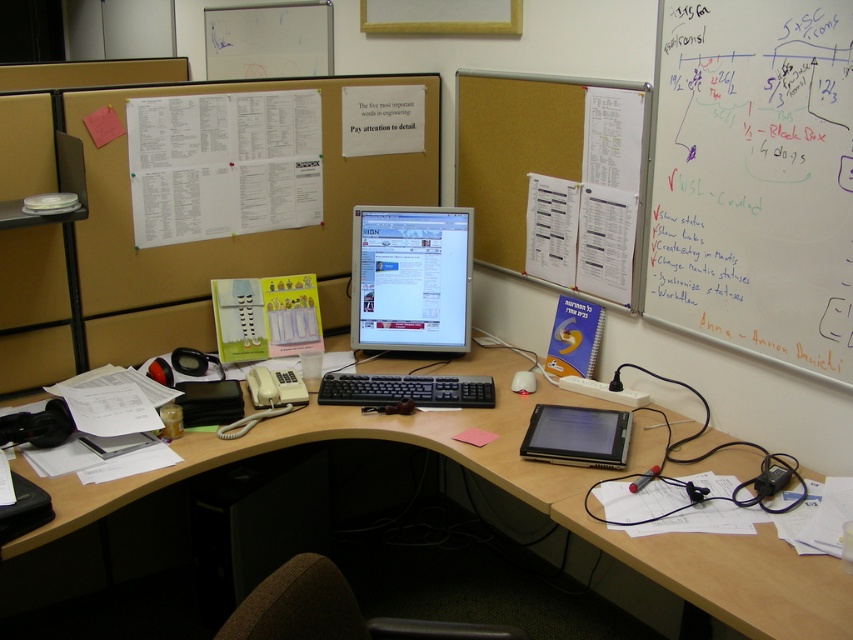
You are an office worker who needs to write a note on the pink paper at center. Can you do so without moving the black glossy tablet at center?

The black glossy tablet at center is positioned over the pink paper at center, so you cannot write on the pink paper at center without moving the tablet first.

You need to place both the black glossy tablet at center and the pink paper at center into a rectangular box that can only hold items up to the width of the tablet. Which item will not fit if placed sideways?

The pink paper at center will not fit because the black glossy tablet at center is wider, so the box can only accommodate items up to its width, and the pink paper at center is narrower but if placed sideways might exceed the tablet width. Wait, but the description says the tablet is wider than the paper. So if the box can hold up to the tablet width, the paper should fit even sideways. Hmm, maybe the question is flawed. Alternatively, perhaps the paper when placed sideways is longer than the tablet width?

Consider the image. What is the location of the point labeled as point (x=556, y=179) in the office cubicle scene?

The point labeled as point (x=556, y=179) is located on the corkboard at upper right.